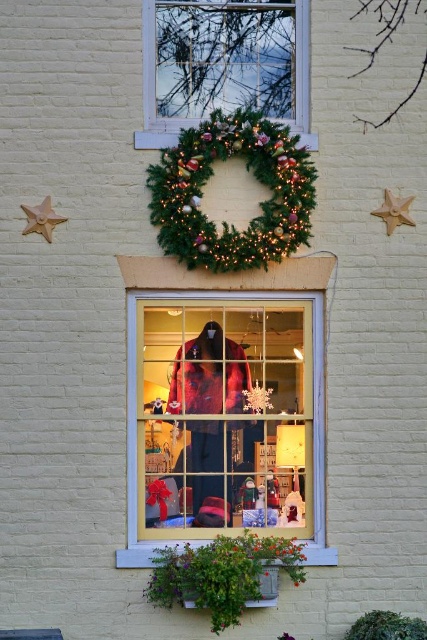
Between point (304, 452) and point (278, 205), which one is positioned in front?

Positioned in front is point (278, 205).

I want to click on velvet red coat at center, so click(224, 417).

Identify the location of velvet red coat at center. This screenshot has width=427, height=640. (224, 417).

Which is more to the left, green garland at upper center or gold matte star at upper left?

gold matte star at upper left

From the picture: Does green garland at upper center appear under gold matte star at upper left?

No, green garland at upper center is not below gold matte star at upper left.

This screenshot has height=640, width=427. In order to click on green garland at upper center in this screenshot , I will do `click(154, 92)`.

Between velvet red coat at center and green garland at upper center, which one is positioned lower?

velvet red coat at center

Is point (195, 442) positioned in front of point (307, 4)?

That is True.

Locate an element on the screen. The image size is (427, 640). velvet red coat at center is located at coordinates tap(224, 417).